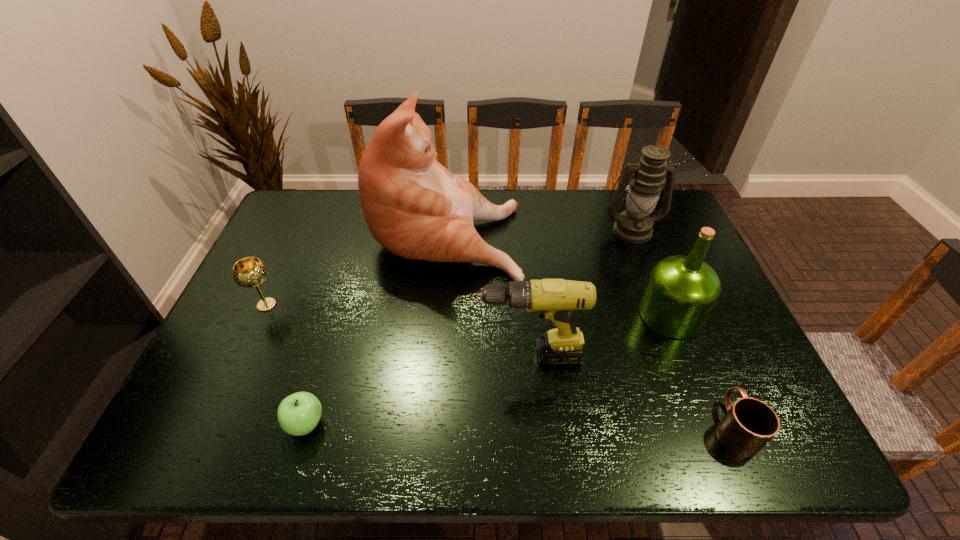
What are the coordinates of `cat` in the screenshot? It's located at (414, 207).

Find the location of `oil lamp`. oil lamp is located at coordinates (634, 224).

Find the location of a particular element. This screenshot has width=960, height=540. olive oil is located at coordinates (681, 292).

This screenshot has height=540, width=960. What are the coordinates of `the fifth farthest object` in the screenshot? It's located at (554, 299).

Image resolution: width=960 pixels, height=540 pixels. I want to click on chalice, so click(x=249, y=272).

This screenshot has width=960, height=540. Identify the location of the fifth tallest object. (249, 272).

In order to click on apple in this screenshot , I will do `click(298, 414)`.

Identify the location of mug. The image size is (960, 540). (749, 424).

This screenshot has height=540, width=960. In order to click on free space located on the face of the tallest object in this screenshot , I will do `click(587, 233)`.

Find the location of a particular element. free space located on the front of the oil lamp is located at coordinates (656, 291).